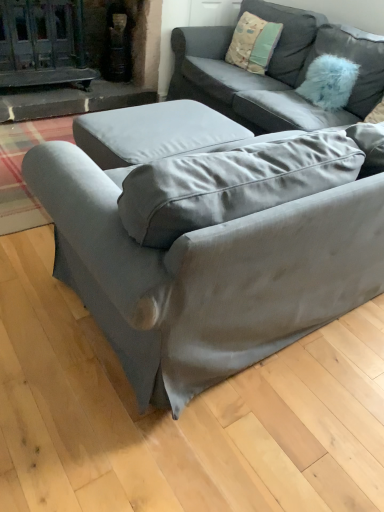
Question: From the image's perspective, would you say fuzzy blue pillow at upper right, placed as the 2th pillow when sorted from left to right, is positioned over textured cotton pillow at upper right, acting as the 1th pillow starting from the left?

Choices:
 (A) no
 (B) yes

Answer: (A)

Question: Would you say fuzzy blue pillow at upper right, which is counted as the first pillow, starting from the right, is a long distance from textured cotton pillow at upper right, acting as the 1th pillow starting from the left?

Choices:
 (A) yes
 (B) no

Answer: (B)

Question: Is fuzzy blue pillow at upper right, which is counted as the first pillow, starting from the right, turned away from textured cotton pillow at upper right, acting as the 1th pillow starting from the left?

Choices:
 (A) no
 (B) yes

Answer: (A)

Question: Can you confirm if fuzzy blue pillow at upper right, placed as the 2th pillow when sorted from left to right, is smaller than textured cotton pillow at upper right, acting as the 1th pillow starting from the left?

Choices:
 (A) yes
 (B) no

Answer: (A)

Question: Can you confirm if fuzzy blue pillow at upper right, placed as the 2th pillow when sorted from left to right, is wider than textured cotton pillow at upper right, acting as the 1th pillow starting from the left?

Choices:
 (A) yes
 (B) no

Answer: (A)

Question: Looking at the image, does satin gray couch at center, the second studio couch in the front-to-back sequence, seem bigger or smaller compared to textured cotton pillow at upper right, acting as the second pillow starting from the right?

Choices:
 (A) small
 (B) big

Answer: (B)

Question: Does point (190, 72) appear closer or farther from the camera than point (243, 64)?

Choices:
 (A) closer
 (B) farther

Answer: (A)

Question: Relative to textured cotton pillow at upper right, acting as the second pillow starting from the right, is satin gray couch at center, the second studio couch in the front-to-back sequence, in front or behind?

Choices:
 (A) behind
 (B) front

Answer: (B)

Question: Considering the relative positions of satin gray couch at center, the second studio couch in the front-to-back sequence, and textured cotton pillow at upper right, acting as the 1th pillow starting from the left, in the image provided, is satin gray couch at center, the second studio couch in the front-to-back sequence, to the left or to the right of textured cotton pillow at upper right, acting as the 1th pillow starting from the left,?

Choices:
 (A) right
 (B) left

Answer: (A)

Question: Is satin gray couch at center, the 1th studio couch in the front-to-back sequence, wider or thinner than fuzzy blue pillow at upper right, which is counted as the first pillow, starting from the right?

Choices:
 (A) wide
 (B) thin

Answer: (A)

Question: Is satin gray couch at center, acting as the 2th studio couch starting from the back, in front of or behind fuzzy blue pillow at upper right, which is counted as the first pillow, starting from the right, in the image?

Choices:
 (A) behind
 (B) front

Answer: (B)

Question: From the image's perspective, is satin gray couch at center, the 1th studio couch in the front-to-back sequence, above or below fuzzy blue pillow at upper right, which is counted as the first pillow, starting from the right?

Choices:
 (A) below
 (B) above

Answer: (A)

Question: Does point (94, 270) appear closer or farther from the camera than point (367, 74)?

Choices:
 (A) closer
 (B) farther

Answer: (A)

Question: From the image's perspective, is textured cotton pillow at upper right, acting as the second pillow starting from the right, located above or below satin gray couch at center, the second studio couch in the front-to-back sequence?

Choices:
 (A) below
 (B) above

Answer: (B)

Question: Is textured cotton pillow at upper right, acting as the second pillow starting from the right, taller or shorter than satin gray couch at center, acting as the first studio couch starting from the back?

Choices:
 (A) short
 (B) tall

Answer: (A)